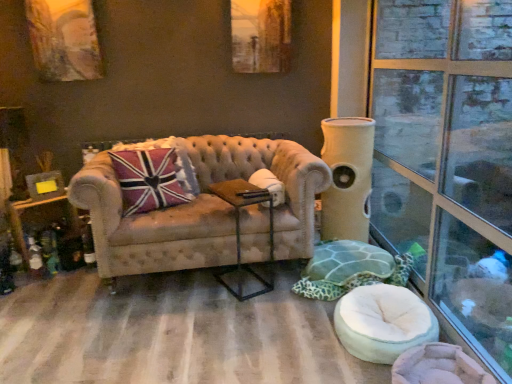
Question: Is tufted beige couch at center to the left of green fabric swivel chair at lower right, which is the first swivel chair from back to front, from the viewer's perspective?

Choices:
 (A) no
 (B) yes

Answer: (B)

Question: Does tufted beige couch at center have a greater height compared to green fabric swivel chair at lower right, which is the first swivel chair from back to front?

Choices:
 (A) no
 (B) yes

Answer: (B)

Question: Is tufted beige couch at center not close to green fabric swivel chair at lower right, placed as the 2th swivel chair when sorted from front to back?

Choices:
 (A) no
 (B) yes

Answer: (A)

Question: From the image's perspective, is tufted beige couch at center on top of green fabric swivel chair at lower right, which is the first swivel chair from back to front?

Choices:
 (A) yes
 (B) no

Answer: (A)

Question: Does tufted beige couch at center touch green fabric swivel chair at lower right, placed as the 2th swivel chair when sorted from front to back?

Choices:
 (A) no
 (B) yes

Answer: (A)

Question: Looking at the image, does green fabric swivel chair at lower right, placed as the 2th swivel chair when sorted from front to back, seem bigger or smaller compared to clear glass window at right?

Choices:
 (A) big
 (B) small

Answer: (A)

Question: Considering the positions of point (374, 278) and point (502, 3), is point (374, 278) closer or farther from the camera than point (502, 3)?

Choices:
 (A) closer
 (B) farther

Answer: (A)

Question: Considering their positions, is green fabric swivel chair at lower right, which is the first swivel chair from back to front, located in front of or behind clear glass window at right?

Choices:
 (A) behind
 (B) front

Answer: (A)

Question: From their relative heights in the image, would you say green fabric swivel chair at lower right, placed as the 2th swivel chair when sorted from front to back, is taller or shorter than clear glass window at right?

Choices:
 (A) short
 (B) tall

Answer: (A)

Question: Does point (499, 347) appear closer or farther from the camera than point (333, 155)?

Choices:
 (A) farther
 (B) closer

Answer: (B)

Question: Considering their positions, is clear glass window at right located in front of or behind beige fabric cat tower at right?

Choices:
 (A) front
 (B) behind

Answer: (A)

Question: Considering the positions of clear glass window at right and beige fabric cat tower at right in the image, is clear glass window at right taller or shorter than beige fabric cat tower at right?

Choices:
 (A) tall
 (B) short

Answer: (A)

Question: Considering the relative positions of clear glass window at right and beige fabric cat tower at right in the image provided, is clear glass window at right to the left or to the right of beige fabric cat tower at right?

Choices:
 (A) right
 (B) left

Answer: (A)

Question: Is metallic brown side table at center to the left or to the right of clear glass window at right in the image?

Choices:
 (A) left
 (B) right

Answer: (A)

Question: In the image, is metallic brown side table at center positioned in front of or behind clear glass window at right?

Choices:
 (A) front
 (B) behind

Answer: (B)